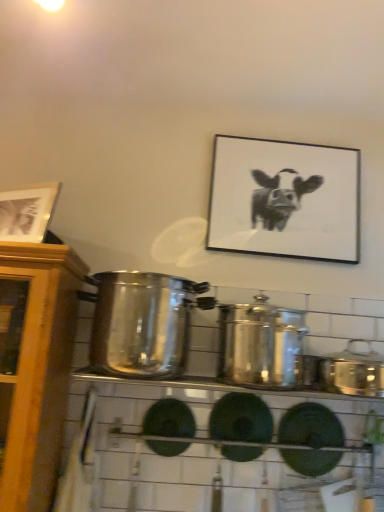
At what (x,y) coordinates should I click in order to perform the action: click on free spot above black matte picture frame at upper center, positioned as the 1th picture frame in right-to-left order (from a real-world perspective). Please return your answer as a coordinate pair (x, y). Image resolution: width=384 pixels, height=512 pixels. Looking at the image, I should click on (302, 138).